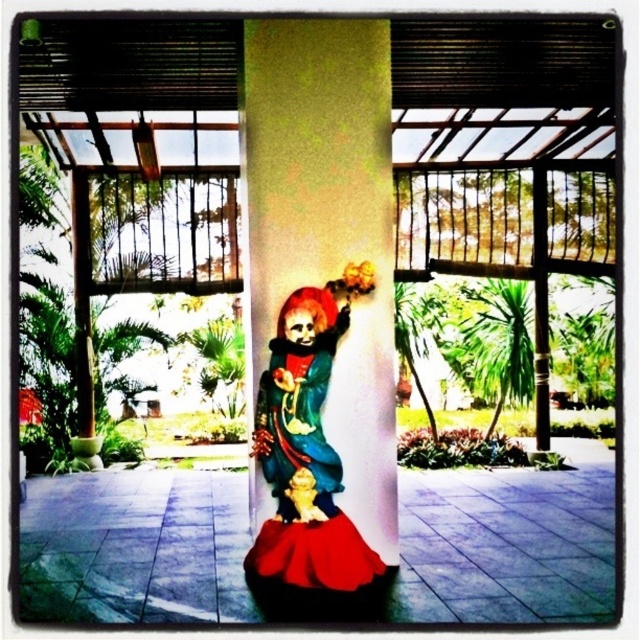
Question: Considering the relative positions of matte yellow pillar at center and matte red dress at center in the image provided, where is matte yellow pillar at center located with respect to matte red dress at center?

Choices:
 (A) below
 (B) above

Answer: (B)

Question: Which object is farther from the camera taking this photo?

Choices:
 (A) matte red dress at center
 (B) gold metallic statue at center

Answer: (B)

Question: Is matte yellow pillar at center to the right of matte red dress at center from the viewer's perspective?

Choices:
 (A) yes
 (B) no

Answer: (A)

Question: Is matte yellow pillar at center further to camera compared to gold metallic statue at center?

Choices:
 (A) yes
 (B) no

Answer: (A)

Question: Which of the following is the farthest from the observer?

Choices:
 (A) (388, 225)
 (B) (298, 420)

Answer: (A)

Question: Among these points, which one is nearest to the camera?

Choices:
 (A) (330, 456)
 (B) (310, 518)
 (C) (256, 195)

Answer: (B)